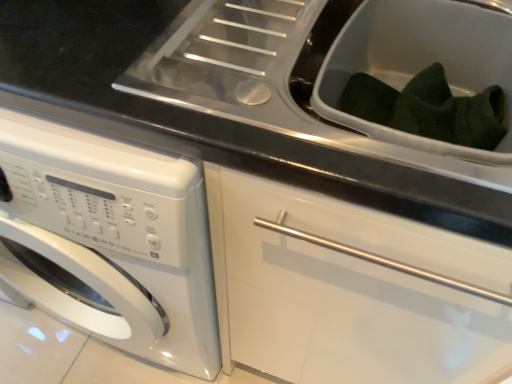
Question: From their relative heights in the image, would you say white plastic sink at center, acting as the 1th sink starting from the front, is taller or shorter than dark green fabric at upper right, which is the second sink in front-to-back order?

Choices:
 (A) tall
 (B) short

Answer: (A)

Question: Visually, is white plastic sink at center, acting as the 1th sink starting from the front, positioned to the left or to the right of dark green fabric at upper right, which is the second sink in front-to-back order?

Choices:
 (A) right
 (B) left

Answer: (B)

Question: Which object is positioned farthest from the dark green fabric at upper right, which is the first sink from back to front?

Choices:
 (A) white glossy washing machine at left
 (B) white plastic sink at center, acting as the 1th sink starting from the front

Answer: (A)

Question: Estimate the real-world distances between objects in this image. Which object is farther from the white glossy washing machine at left?

Choices:
 (A) dark green fabric at upper right, which is the second sink in front-to-back order
 (B) white plastic sink at center, acting as the 1th sink starting from the front

Answer: (A)